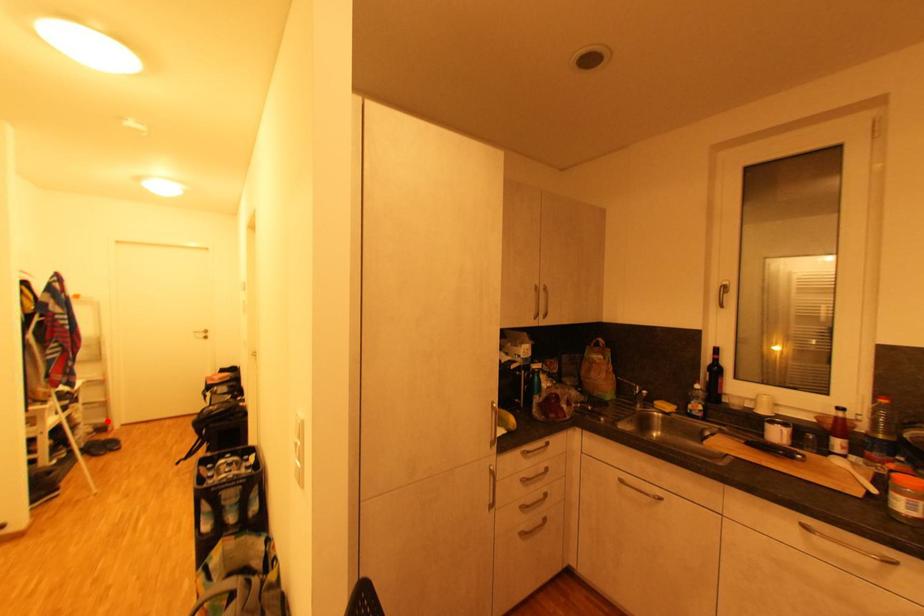
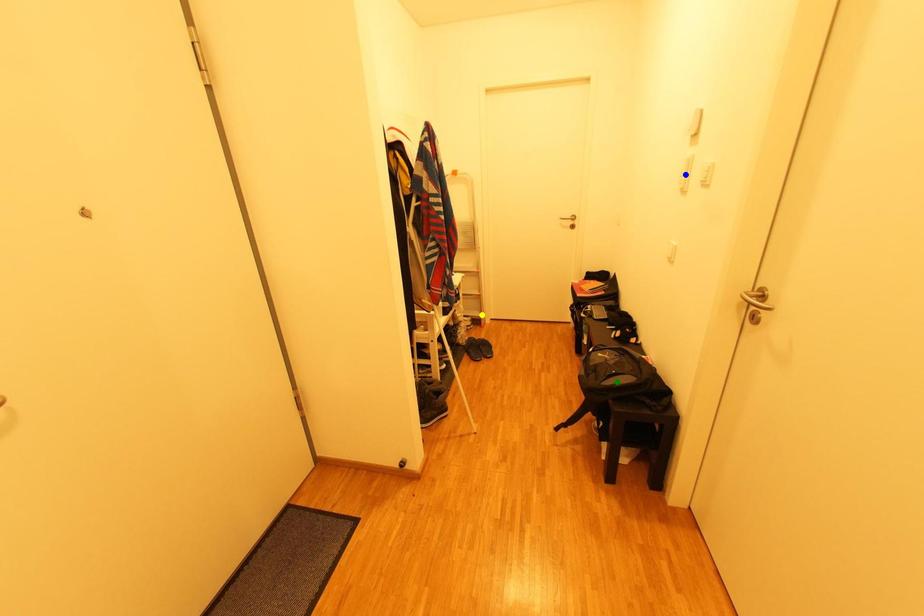
Question: I am providing you with two images of the same scene from different viewpoints. A red point is marked on the first image. You are given multiple points on the second image. Which spot in image 2 lines up with the point in image 1?

Choices:
 (A) green point
 (B) yellow point
 (C) blue point

Answer: (B)